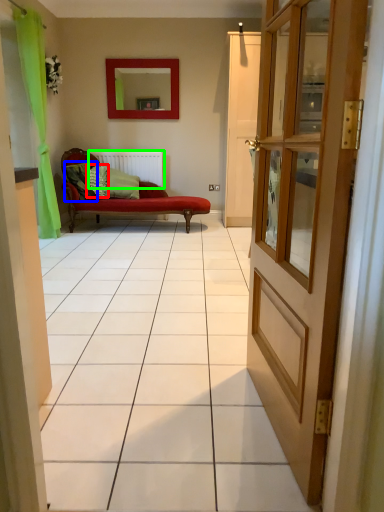
Question: Based on their relative distances, which object is nearer to pillow (highlighted by a red box)? Choose from pillow (highlighted by a blue box) and radiator (highlighted by a green box).

Choices:
 (A) pillow
 (B) radiator

Answer: (A)